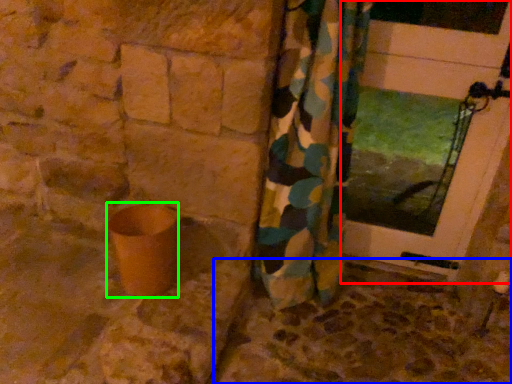
Question: Considering the real-world distances, which object is farthest from door (highlighted by a red box)? concrete (highlighted by a blue box) or pottery (highlighted by a green box)?

Choices:
 (A) concrete
 (B) pottery

Answer: (B)